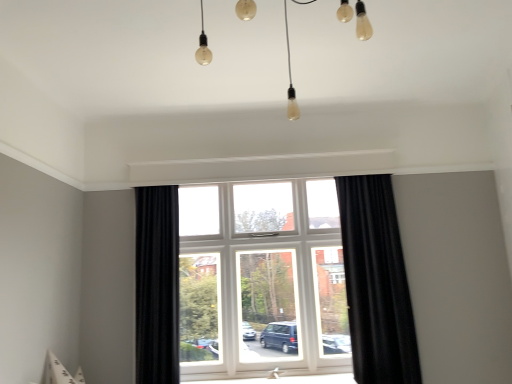
Question: Is black textured curtain at right, arranged as the 1th curtain when viewed from the right, wider or thinner than black velvet curtain at center, placed as the second curtain when sorted from right to left?

Choices:
 (A) wide
 (B) thin

Answer: (A)

Question: From a real-world perspective, is black textured curtain at right, arranged as the 1th curtain when viewed from the right, positioned above or below black velvet curtain at center, placed as the 1th curtain when sorted from left to right?

Choices:
 (A) below
 (B) above

Answer: (A)

Question: Which object is the closest to the black textured curtain at right, arranged as the 1th curtain when viewed from the right?

Choices:
 (A) white plastic window at center
 (B) black velvet curtain at center, placed as the 1th curtain when sorted from left to right
 (C) matte glass light bulbs at upper center

Answer: (A)

Question: Estimate the real-world distances between objects in this image. Which object is farther from the matte glass light bulbs at upper center?

Choices:
 (A) white plastic window at center
 (B) black textured curtain at right, the second curtain positioned from the left
 (C) black velvet curtain at center, placed as the second curtain when sorted from right to left

Answer: (C)